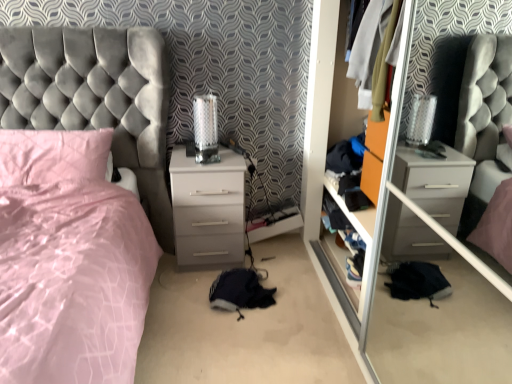
Where is `free space to the left of wooden shelf at center`? free space to the left of wooden shelf at center is located at coordinates (295, 278).